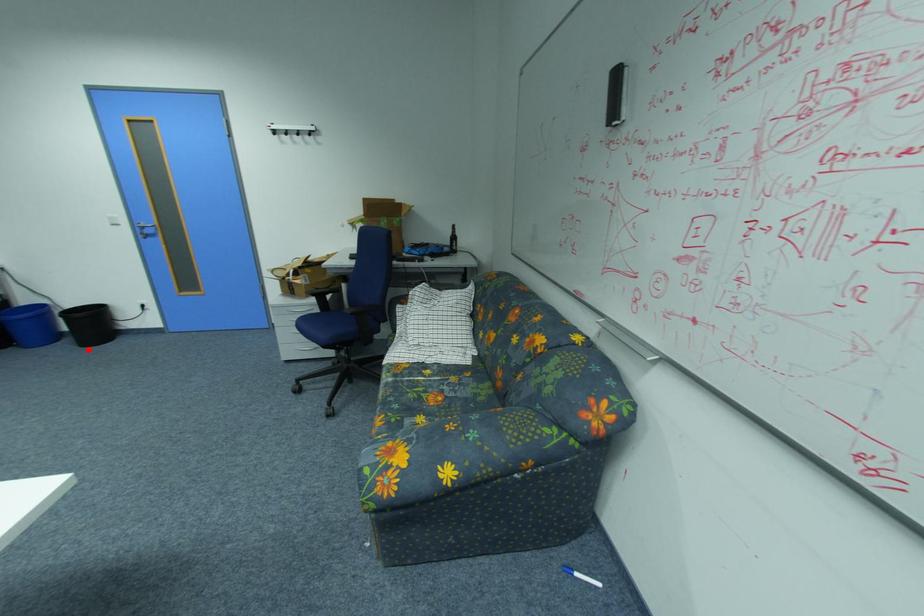
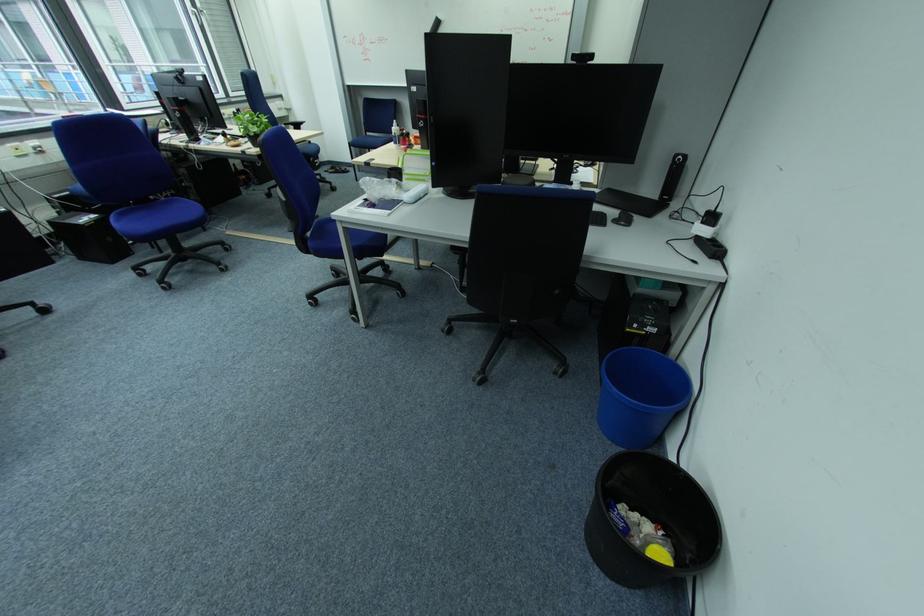
Question: I am providing you with two images of the same scene from different viewpoints. Given a red point in image1, look at the same physical point in image2. Is it:

Choices:
 (A) Closer to the viewpoint
 (B) Farther from the viewpoint

Answer: (B)